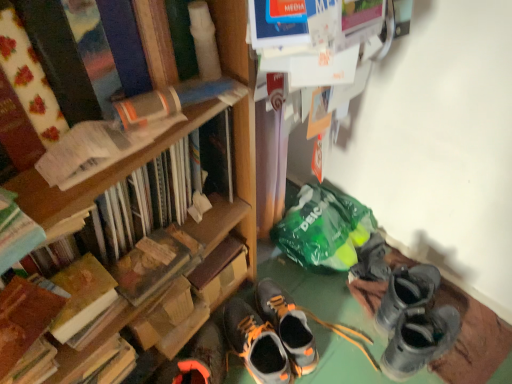
Question: Considering their positions, is hardcover book at left, which is counted as the fourth book, starting from the top, located in front of or behind hardcover book at center?

Choices:
 (A) behind
 (B) front

Answer: (B)

Question: Considering the positions of hardcover book at left, which is counted as the fourth book, starting from the top, and hardcover book at center in the image, is hardcover book at left, which is counted as the fourth book, starting from the top, bigger or smaller than hardcover book at center?

Choices:
 (A) small
 (B) big

Answer: (A)

Question: Based on their relative distances, which object is nearer to the hardcover book at center?

Choices:
 (A) hardcover book at left, which appears as the second book when viewed from the top
 (B) orange suede sneaker at lower center, the first footwear positioned from the left
 (C) orange and black leather shoes at center, the second footwear in the left-to-right sequence
 (D) gray suede sneakers at center, marked as the first footwear in a right-to-left arrangement
 (E) hardcover book at left, the fifth book positioned from the bottom

Answer: (A)

Question: Estimate the real-world distances between objects in this image. Which object is closer to the hardcover book at left, which is the fifth book in top-to-bottom order?

Choices:
 (A) gray suede sneakers at center, marked as the first footwear in a right-to-left arrangement
 (B) hardcover book at center
 (C) hardcover book at left, which appears as the second book when viewed from the top
 (D) hardcover book at left, the fifth book positioned from the bottom
 (E) orange suede sneaker at lower center, the first footwear positioned from the left

Answer: (B)